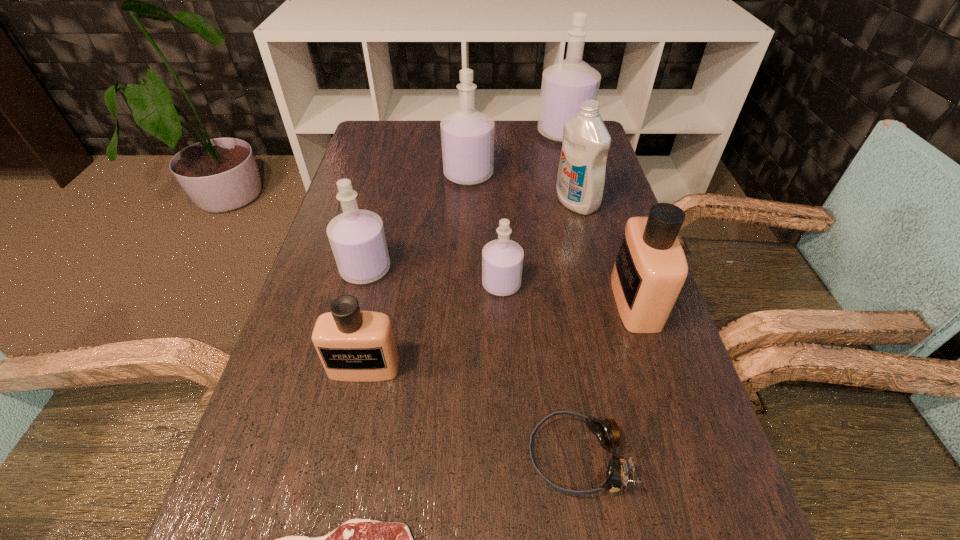
Locate an element on the screen. free spot between the leftmost purple perfume and the white detergent is located at coordinates (471, 236).

You are a GUI agent. You are given a task and a screenshot of the screen. Output one action in this format:
    pyautogui.click(x=<x>, y=<y>)
    Task: Click on the object that ranks as the closest to the eighth tallest object
    This screenshot has height=540, width=960.
    Given the screenshot: What is the action you would take?
    pyautogui.click(x=357, y=539)

Locate which object is the seventh closest to the white detergent. Please provide its 2D coordinates. Your answer should be formatted as a tuple, i.e. [(x, y)], where the tuple contains the x and y coordinates of a point satisfying the conditions above.

[(606, 431)]

Where is `perfume that is the second closest to the nearest object`? The height and width of the screenshot is (540, 960). perfume that is the second closest to the nearest object is located at coordinates (502, 259).

This screenshot has height=540, width=960. Find the location of `perfume that is the sixth closest to the goggles`. perfume that is the sixth closest to the goggles is located at coordinates (565, 85).

Select which purple perfume is the closest to the steak. Please provide its 2D coordinates. Your answer should be formatted as a tuple, i.e. [(x, y)], where the tuple contains the x and y coordinates of a point satisfying the conditions above.

[(502, 259)]

Where is `purple perfume that stands as the second closest to the second farthest perfume`? This screenshot has height=540, width=960. purple perfume that stands as the second closest to the second farthest perfume is located at coordinates (357, 238).

Where is `vacant space that satisfies the following two spatial constraints: 1. on the back side of the detergent; 2. on the right side of the smallest purple perfume`? vacant space that satisfies the following two spatial constraints: 1. on the back side of the detergent; 2. on the right side of the smallest purple perfume is located at coordinates (497, 202).